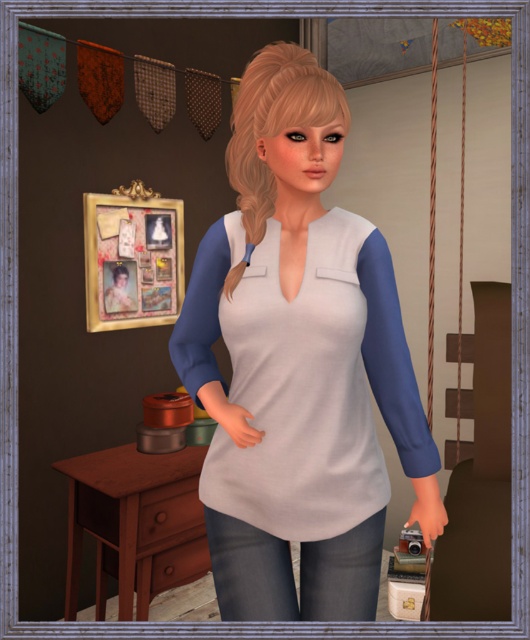
You are a character in the scene and want to place a small camera in your right hand onto the brown wood dresser at lower left. Based on the coordinates provided, can you reach the point at coordinate point (x=136, y=524)?

The point at coordinate (x=136, y=524) is on the brown wood dresser at lower left. Since the character is holding a small camera in their right hand, they can reach and place it at that coordinate on the dresser.

Based on the scene description, can you determine the spatial relationship between the matte white fabric shirt at center and the denim jeans at lower center?

The matte white fabric shirt at center is above the denim jeans at lower center.